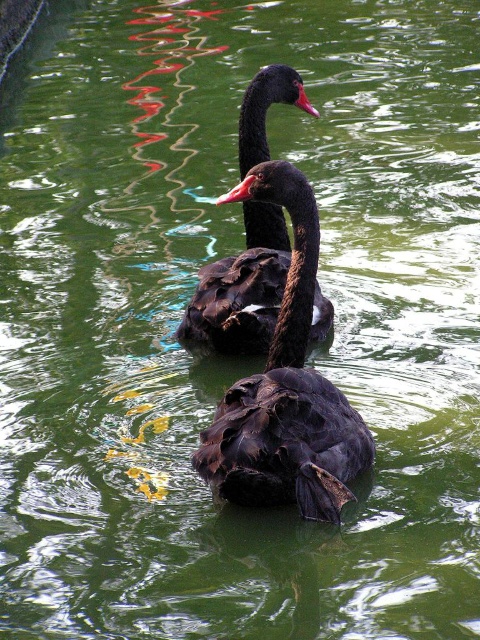
You are standing on the edge of the water and want to feed the shiny black swan at center. If you have a snack in your hand, can you reach it without moving from your current position? Assume your arm can extend 1.5 meters.

The shiny black swan at center is 3.66 meters away from the viewer. Since your arm can only extend 1.5 meters, you cannot reach the swan without moving closer.

You are standing at a point 3.68 meters away from the camera. You want to take a photo of the two black swans swimming in the water. Can you confirm if you are positioned at point (x=249, y=452)?

Yes, you are positioned at point (x=249, y=452) because the distance between that point and the camera is 3.68 meters, which matches your current position.

You are observing two points in the image of the swans. Which point is nearer to you, point (332,518) or point (183,328)?

Point (332,518) is closer to the viewer than point (183,328).